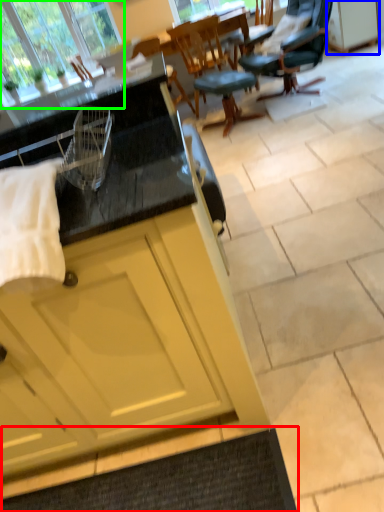
Question: Which is farther away from doormat (highlighted by a red box)? cabinetry (highlighted by a blue box) or window (highlighted by a green box)?

Choices:
 (A) cabinetry
 (B) window

Answer: (A)